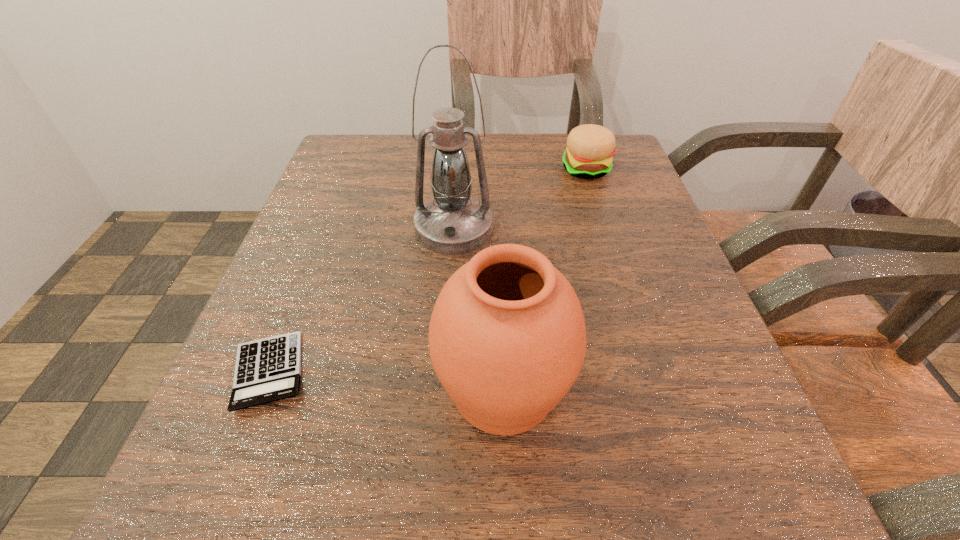
Locate an element on the screen. free space located on the right of the leftmost object is located at coordinates (557, 372).

The height and width of the screenshot is (540, 960). I want to click on object located at the far edge, so click(590, 147).

What are the coordinates of `object present at the near edge` in the screenshot? It's located at (507, 338).

Image resolution: width=960 pixels, height=540 pixels. What are the coordinates of `object present at the left edge` in the screenshot? It's located at (269, 369).

Where is `object present at the right edge`? The width and height of the screenshot is (960, 540). object present at the right edge is located at coordinates (590, 147).

Locate an element on the screen. The height and width of the screenshot is (540, 960). object at the far right corner is located at coordinates (590, 147).

In the image, there is a desktop. Where is `free space at the far edge`? This screenshot has height=540, width=960. free space at the far edge is located at coordinates (488, 167).

In the image, there is a desktop. Identify the location of blank space at the near edge. The width and height of the screenshot is (960, 540). (466, 519).

This screenshot has width=960, height=540. I want to click on free space at the left edge of the desktop, so click(358, 275).

Image resolution: width=960 pixels, height=540 pixels. In the image, there is a desktop. Find the location of `vacant region at the right edge`. vacant region at the right edge is located at coordinates (589, 208).